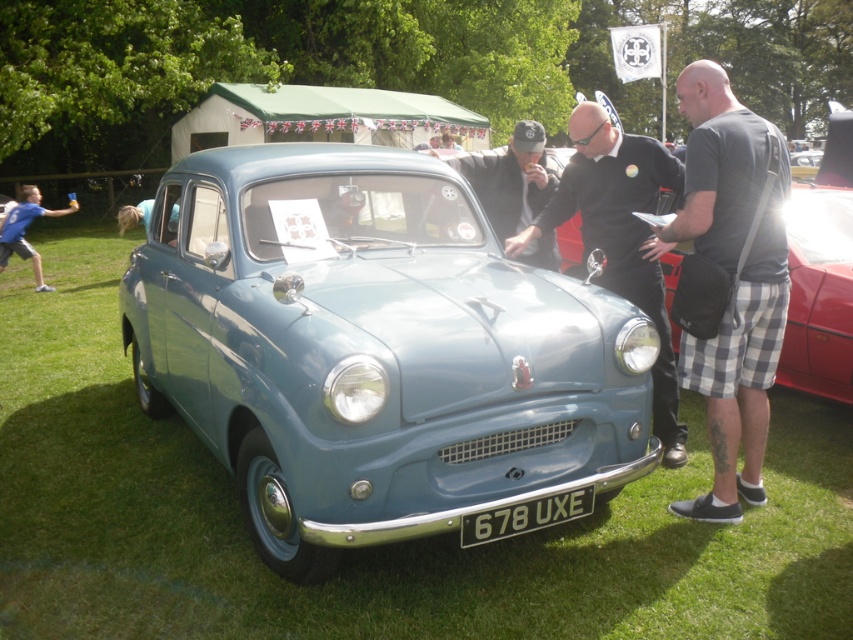
Question: Can you confirm if blue t-shirt at left is thinner than metallic silver car at center?

Choices:
 (A) yes
 (B) no

Answer: (A)

Question: Which point is farther to the camera?

Choices:
 (A) matte blue car at center
 (B) metallic silver car at center
 (C) blue t-shirt at left

Answer: (C)

Question: Which of the following is the closest to the observer?

Choices:
 (A) matte blue car at center
 (B) black metal license plate at center
 (C) black leather jacket at center

Answer: (A)

Question: Which object appears farthest from the camera in this image?

Choices:
 (A) metallic silver car at center
 (B) matte blue car at center

Answer: (A)

Question: Is black leather jacket at center to the right of black metal license plate at center from the viewer's perspective?

Choices:
 (A) yes
 (B) no

Answer: (A)

Question: From the image, what is the correct spatial relationship of blue t-shirt at left in relation to metallic silver car at center?

Choices:
 (A) right
 (B) left

Answer: (B)